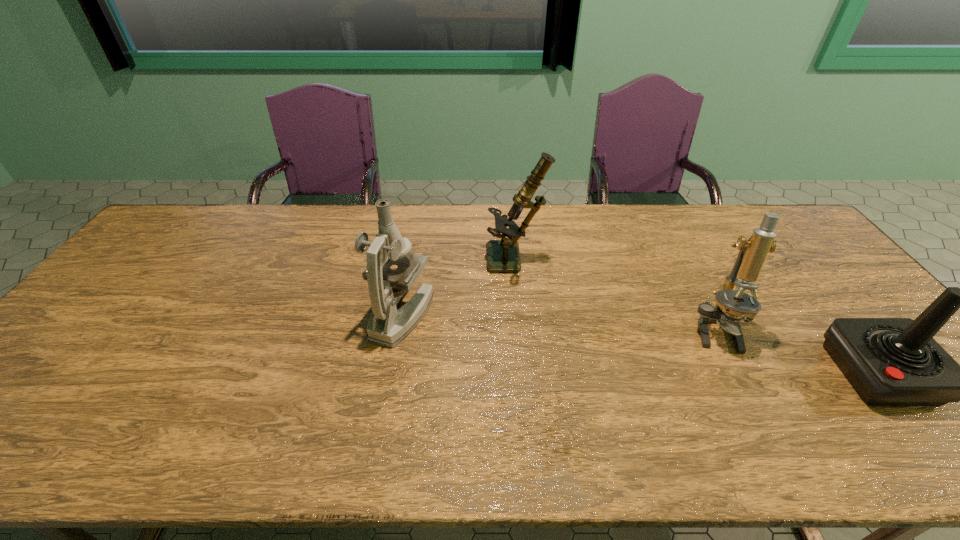
Identify the location of free space located 0.270m on the left of the third object from left to right. The height and width of the screenshot is (540, 960). (588, 330).

At what (x,y) coordinates should I click in order to perform the action: click on free region located 0.220m on the front-facing side of the rightmost object. Please return your answer as a coordinate pair (x, y). This screenshot has height=540, width=960. Looking at the image, I should click on (747, 373).

You are a GUI agent. You are given a task and a screenshot of the screen. Output one action in this format:
    pyautogui.click(x=<x>, y=<y>)
    Task: Click on the blank space located 0.240m on the front-facing side of the rightmost object
    
    Given the screenshot: What is the action you would take?
    pyautogui.click(x=738, y=373)

Locate an element on the screen. free space located 0.290m on the front-facing side of the rightmost object is located at coordinates (717, 373).

You are a GUI agent. You are given a task and a screenshot of the screen. Output one action in this format:
    pyautogui.click(x=<x>, y=<y>)
    Task: Click on the object present at the far edge
    
    Given the screenshot: What is the action you would take?
    pyautogui.click(x=503, y=255)

You are a GUI agent. You are given a task and a screenshot of the screen. Output one action in this format:
    pyautogui.click(x=<x>, y=<y>)
    Task: Click on the object that is at the right edge
    
    Given the screenshot: What is the action you would take?
    pyautogui.click(x=889, y=361)

You are a GUI agent. You are given a task and a screenshot of the screen. Output one action in this format:
    pyautogui.click(x=<x>, y=<y>)
    Task: Click on the vacant space at the far edge
    Image resolution: width=960 pixels, height=540 pixels.
    Given the screenshot: What is the action you would take?
    pyautogui.click(x=708, y=218)

Locate an element on the screen. This screenshot has height=540, width=960. vacant area at the near edge of the desktop is located at coordinates (69, 425).

This screenshot has height=540, width=960. In the image, there is a desktop. What are the coordinates of `vacant space at the left edge` in the screenshot? It's located at (83, 337).

Image resolution: width=960 pixels, height=540 pixels. In the image, there is a desktop. What are the coordinates of `free space at the right edge` in the screenshot? It's located at (801, 256).